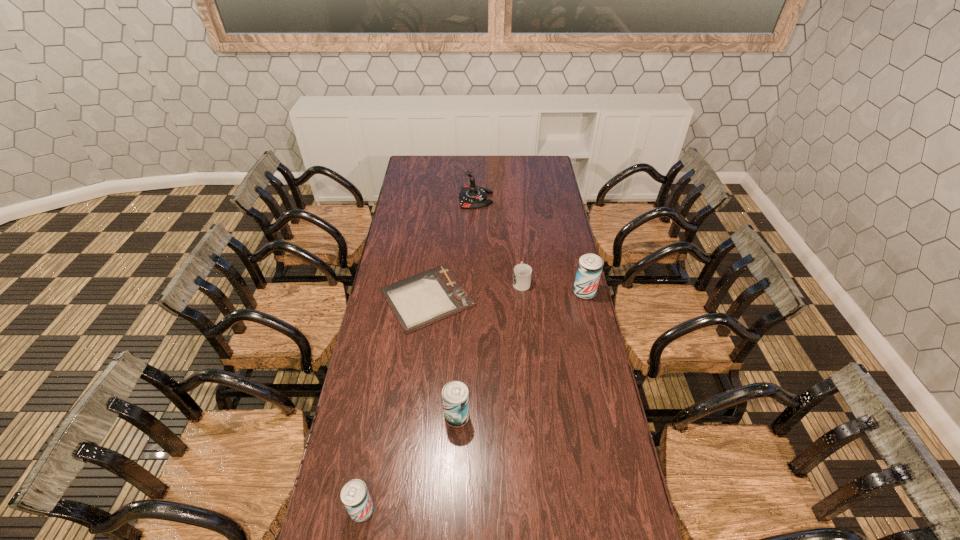
You are a GUI agent. You are given a task and a screenshot of the screen. Output one action in this format:
    pyautogui.click(x=<x>, y=<y>)
    Task: Click on the shortest beer can
    This screenshot has width=960, height=540.
    Given the screenshot: What is the action you would take?
    pyautogui.click(x=355, y=496)

You are a GUI agent. You are given a task and a screenshot of the screen. Output one action in this format:
    pyautogui.click(x=<x>, y=<y>)
    Task: Click on the third shortest object
    The height and width of the screenshot is (540, 960).
    Given the screenshot: What is the action you would take?
    pyautogui.click(x=355, y=496)

Image resolution: width=960 pixels, height=540 pixels. I want to click on the second beer can from left to right, so click(x=455, y=394).

You are a GUI agent. You are given a task and a screenshot of the screen. Output one action in this format:
    pyautogui.click(x=<x>, y=<y>)
    Task: Click on the second nearest object
    This screenshot has height=540, width=960.
    Given the screenshot: What is the action you would take?
    pyautogui.click(x=455, y=394)

Locate an element on the screen. This screenshot has height=540, width=960. the rightmost object is located at coordinates click(x=589, y=269).

In order to click on the farthest beer can in this screenshot , I will do `click(589, 269)`.

Identify the location of joystick. (471, 197).

Where is `the shortest object`? The width and height of the screenshot is (960, 540). the shortest object is located at coordinates (418, 301).

I want to click on the fifth object from left to right, so click(522, 274).

What are the coordinates of `cup` in the screenshot? It's located at (522, 274).